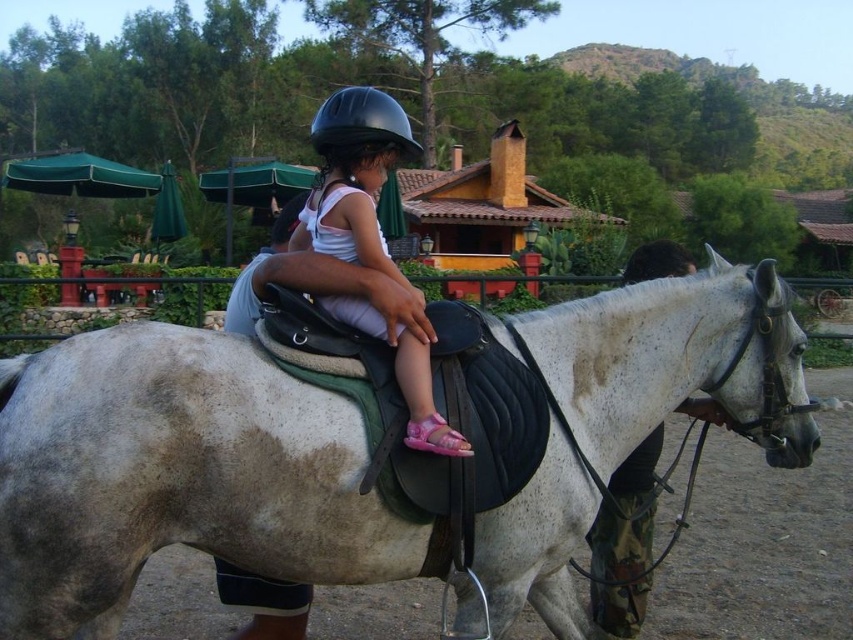
You are a photographer trying to capture the young girl riding the horse. You notice a specific point at coordinates point (354, 177). Where is this point located in relation to the matte black helmet at center?

The point (354, 177) is located on the matte black helmet at center.

You are a photographer positioned to the left of the scene. You want to take a photo of the black matte helmet at center and the white matte horse at center. Which object should you focus on first if you want to capture both in the same frame without moving your camera?

The black matte helmet at center is to the left of the white matte horse at center, so you should focus on the black matte helmet at center first to ensure both objects are in the frame without moving the camera.

You are a safety inspector checking the visibility of the matte black helmet at center. The safety regulation requires that the helmet must be clearly visible from at least 8 feet away. Based on the scene, is the helmet compliant with the regulation?

The matte black helmet at center is positioned at a distance of 7.41 feet from the viewer, which is closer than the required 8 feet. Therefore, the helmet is within the visibility range and complies with the safety regulation.